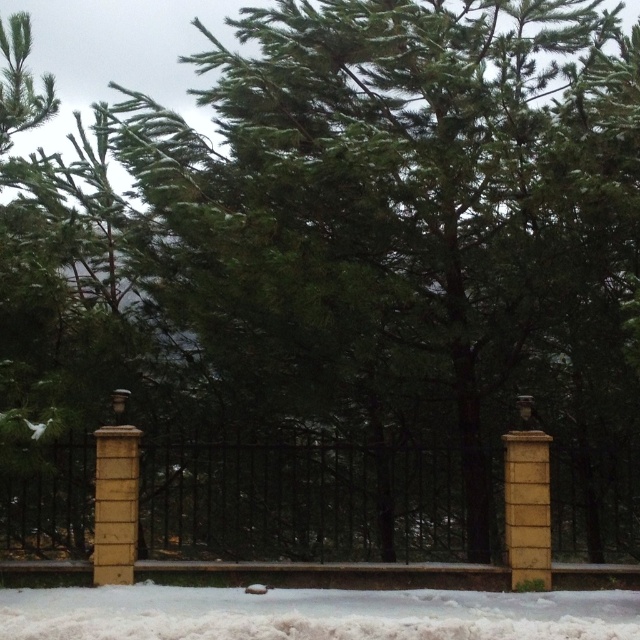
Question: Does brown stone fence at center come behind white fluffy snow at lower center?

Choices:
 (A) yes
 (B) no

Answer: (A)

Question: Which point is closer to the camera taking this photo?

Choices:
 (A) (333, 600)
 (B) (228, 545)

Answer: (A)

Question: Does brown stone fence at center appear over white fluffy snow at lower center?

Choices:
 (A) no
 (B) yes

Answer: (B)

Question: In this image, where is brown stone fence at center located relative to white fluffy snow at lower center?

Choices:
 (A) below
 (B) above

Answer: (B)

Question: Which point appears farthest from the camera in this image?

Choices:
 (A) (576, 548)
 (B) (627, 600)

Answer: (A)